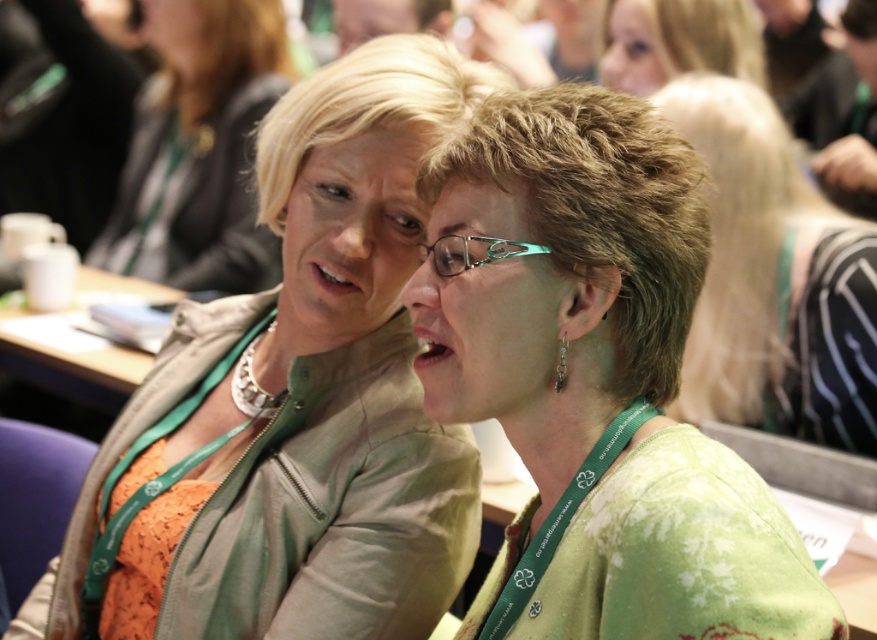
You are an event organizer at the conference and need to identify the speaker. Based on the image, which object is closer to the speaker? The green textured blouse at center or the blonde hair at upper center?

The green textured blouse at center is positioned under blonde hair at upper center, so the blonde hair at upper center is closer to the speaker.

What are the coordinates of the green textured blouse at center?

The green textured blouse at center is located at point (596, 376).